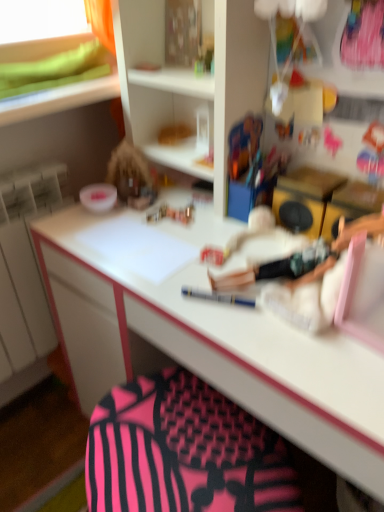
Question: From a real-world perspective, is white glossy bowl at upper left above or below pink fabric swivel chair at lower center?

Choices:
 (A) below
 (B) above

Answer: (B)

Question: Is white glossy bowl at upper left wider or thinner than pink fabric swivel chair at lower center?

Choices:
 (A) wide
 (B) thin

Answer: (B)

Question: Is point (81, 192) closer or farther from the camera than point (200, 481)?

Choices:
 (A) closer
 (B) farther

Answer: (B)

Question: Considering the positions of pink fabric swivel chair at lower center and white glossy bowl at upper left in the image, is pink fabric swivel chair at lower center wider or thinner than white glossy bowl at upper left?

Choices:
 (A) wide
 (B) thin

Answer: (A)

Question: In terms of height, does pink fabric swivel chair at lower center look taller or shorter compared to white glossy bowl at upper left?

Choices:
 (A) short
 (B) tall

Answer: (B)

Question: From a real-world perspective, is pink fabric swivel chair at lower center physically located above or below white glossy bowl at upper left?

Choices:
 (A) above
 (B) below

Answer: (B)

Question: Choose the correct answer: Is pink fabric swivel chair at lower center inside white glossy bowl at upper left or outside it?

Choices:
 (A) inside
 (B) outside

Answer: (B)